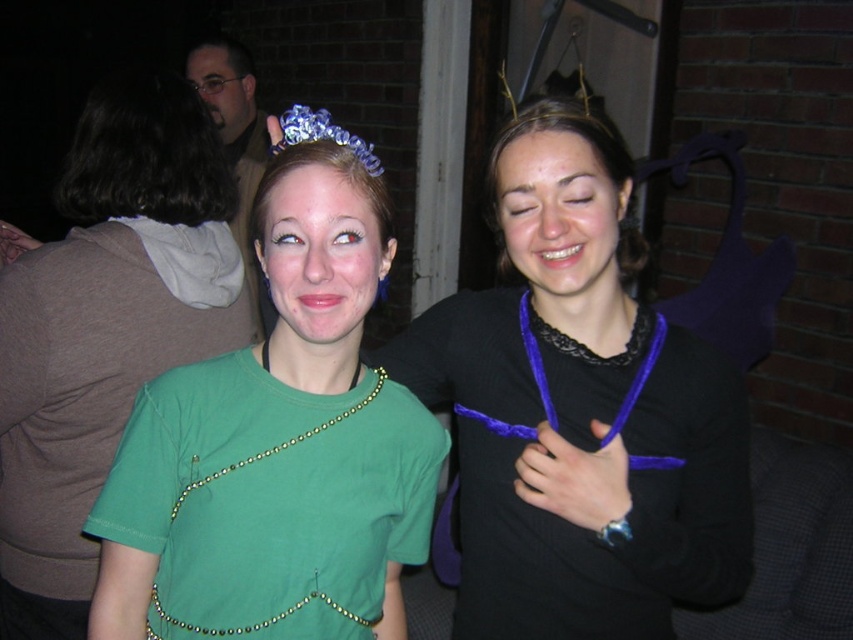
Which is below, purple fabric necklace at center or green fabric necklace at center?

green fabric necklace at center is lower down.

Between point (560, 307) and point (274, 321), which one is positioned in front?

Point (560, 307) is more forward.

I want to click on purple fabric necklace at center, so click(581, 296).

At what (x,y) coordinates should I click in order to perform the action: click on purple fabric necklace at center. Please return your answer as a coordinate pair (x, y). Looking at the image, I should click on (581, 296).

Does purple fabric necklace at center have a greater width compared to green fabric face at center?

No.

Where is `purple fabric necklace at center`? purple fabric necklace at center is located at coordinates (581, 296).

Is point (328, 464) in front of point (541, 228)?

Yes, it is.

Is green fabric dress at center thinner than matte purple necklace at center?

Incorrect, green fabric dress at center's width is not less than matte purple necklace at center's.

Between point (280, 333) and point (567, 134), which one is positioned behind?

The point (567, 134) is behind.

Where is `green fabric dress at center`? This screenshot has width=853, height=640. green fabric dress at center is located at coordinates (277, 442).